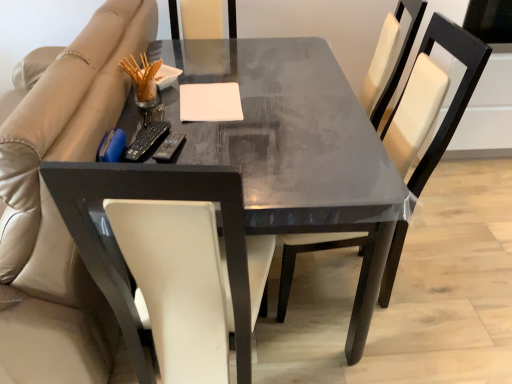
This screenshot has height=384, width=512. I want to click on vacant space in white matte notepad at center (from a real-world perspective), so click(x=209, y=102).